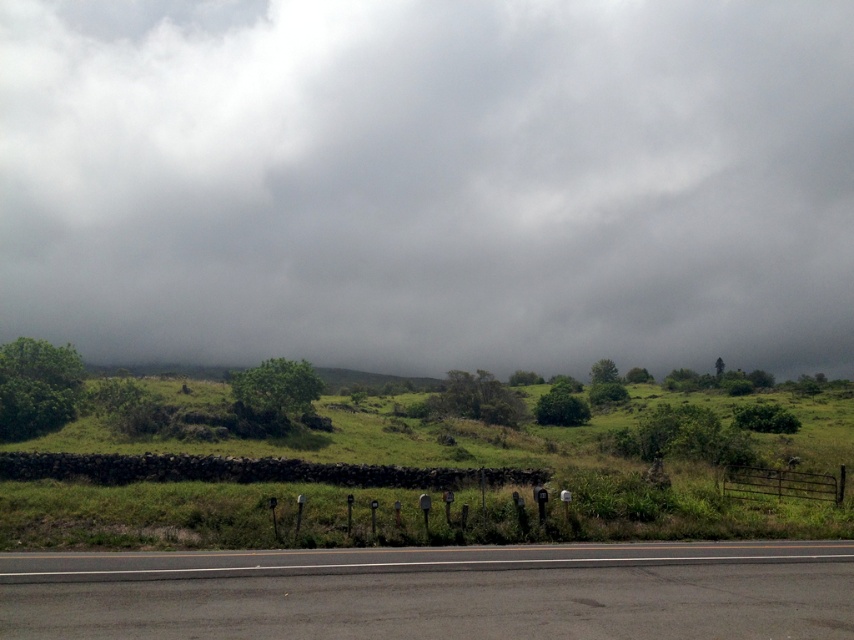
You are standing on the paved road in the rural landscape and looking towards the sky. There is a point marked at coordinates (430, 182). Based on the scene description, where is this point located?

The point (430, 182) is on the gray cloudy sky at upper center.

Based on the scene description, which object occupies a greater area in the image? Please consider the gray cloudy sky at upper center and the green grassy hillside at center in your answer.

The gray cloudy sky at upper center is larger in size than the green grassy hillside at center, so the gray cloudy sky at upper center occupies a greater area in the image.

You are a driver navigating a route and see the green grassy hillside at center and the black asphalt highway at lower center. Which of these two landmarks is bigger in the image?

The green grassy hillside at center is larger in size than the black asphalt highway at lower center, so the green grassy hillside at center is bigger in the image.